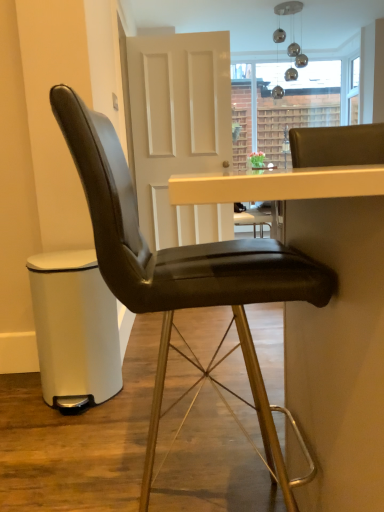
Question: Is white matte door at center oriented towards black leather table at center?

Choices:
 (A) no
 (B) yes

Answer: (B)

Question: Is white matte door at center far away from black leather table at center?

Choices:
 (A) no
 (B) yes

Answer: (B)

Question: Is white matte door at center shorter than black leather table at center?

Choices:
 (A) no
 (B) yes

Answer: (A)

Question: Considering the relative positions of white matte door at center and black leather table at center in the image provided, is white matte door at center behind black leather table at center?

Choices:
 (A) no
 (B) yes

Answer: (B)

Question: Can we say white matte door at center lies outside black leather table at center?

Choices:
 (A) no
 (B) yes

Answer: (B)

Question: From a real-world perspective, is white matte door at center physically above black leather table at center?

Choices:
 (A) no
 (B) yes

Answer: (B)

Question: Is white matte door at center oriented towards black leather chair at center?

Choices:
 (A) no
 (B) yes

Answer: (B)

Question: Considering the relative sizes of white matte door at center and black leather chair at center in the image provided, is white matte door at center taller than black leather chair at center?

Choices:
 (A) yes
 (B) no

Answer: (A)

Question: Is white matte door at center to the right of black leather chair at center from the viewer's perspective?

Choices:
 (A) yes
 (B) no

Answer: (B)

Question: Does white matte door at center have a smaller size compared to black leather chair at center?

Choices:
 (A) no
 (B) yes

Answer: (A)

Question: Is white matte door at center positioned with its back to black leather chair at center?

Choices:
 (A) yes
 (B) no

Answer: (B)

Question: Is white matte door at center shorter than black leather chair at center?

Choices:
 (A) no
 (B) yes

Answer: (A)

Question: Is matte black bar stool at lower left at the right side of black leather table at center?

Choices:
 (A) no
 (B) yes

Answer: (A)